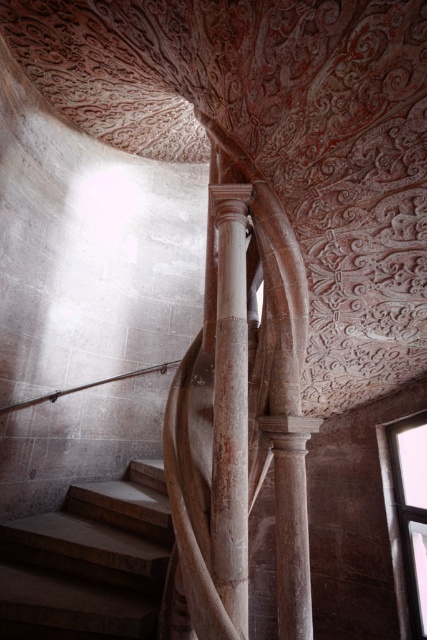
Question: Which object appears closest to the camera in this image?

Choices:
 (A) smooth stone stairs at center
 (B) smooth stone column at center
 (C) satin silver railing at upper center

Answer: (B)

Question: Does smooth stone stairs at center have a smaller size compared to satin silver railing at upper center?

Choices:
 (A) yes
 (B) no

Answer: (B)

Question: Which of the following is the farthest from the observer?

Choices:
 (A) smooth stone stairs at center
 (B) satin silver railing at upper center
 (C) smooth stone column at center

Answer: (B)

Question: Among these points, which one is farthest from the camera?

Choices:
 (A) (81, 545)
 (B) (67, 390)
 (C) (224, 515)

Answer: (B)

Question: From the image, what is the correct spatial relationship of smooth stone stairs at center in relation to smooth stone column at center?

Choices:
 (A) left
 (B) right

Answer: (A)

Question: Observing the image, what is the correct spatial positioning of smooth stone column at center in reference to satin silver railing at upper center?

Choices:
 (A) left
 (B) right

Answer: (B)